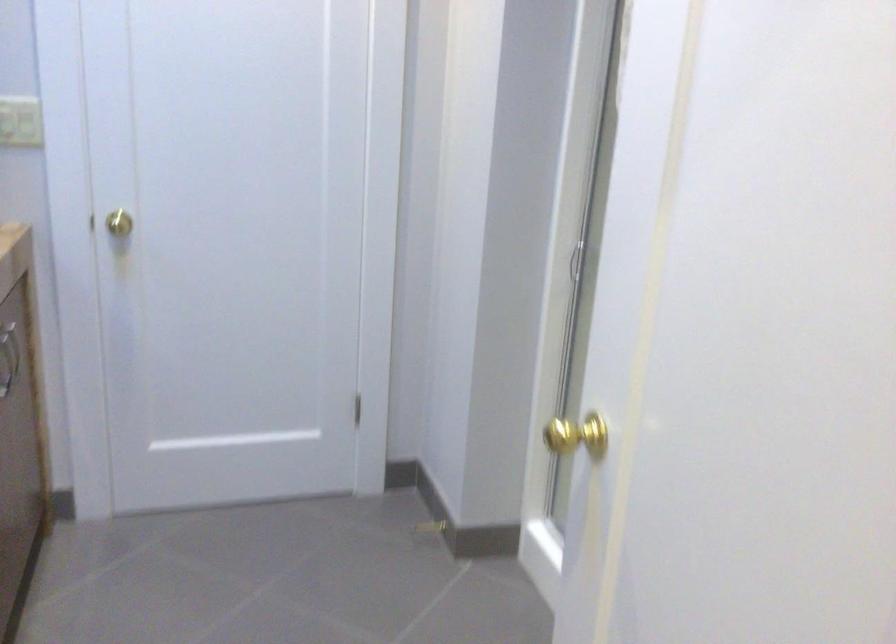
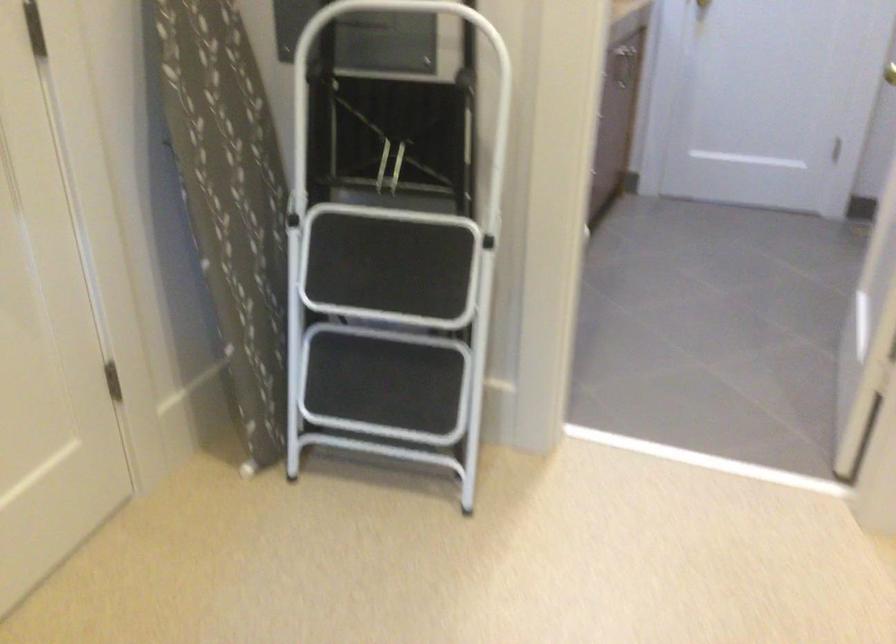
The point at (389, 313) is marked in the first image. Where is the corresponding point in the second image?

(890, 73)